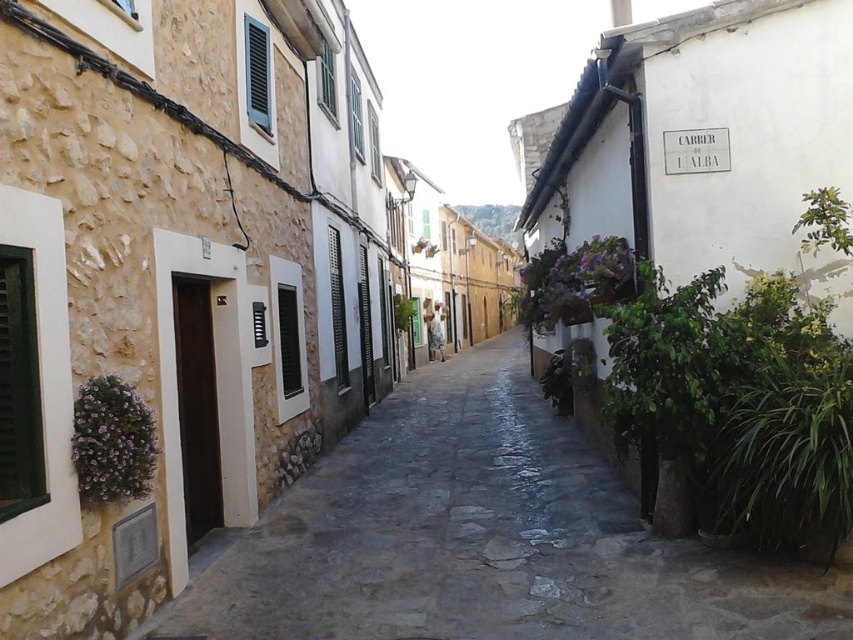
You are a window cleaner standing on the street. You need to clean both the green leafy plant at right and the green matte shutters at center. Which object will require you to use a ladder to reach its top?

The green matte shutters at center are taller than the green leafy plant at right, so you will need a ladder to reach the top of the green matte shutters at center.